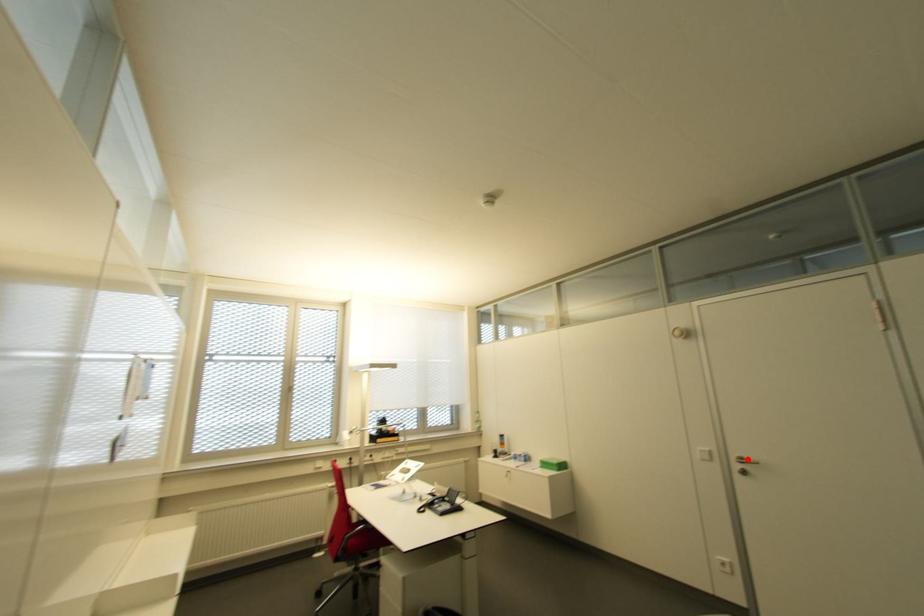
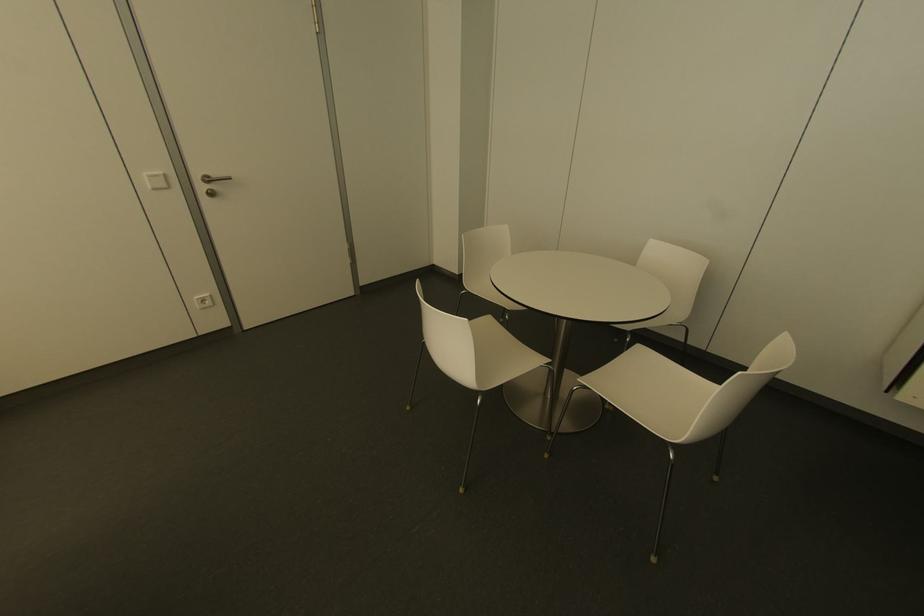
The point at the highlighted location is marked in the first image. Where is the corresponding point in the second image?

(213, 175)